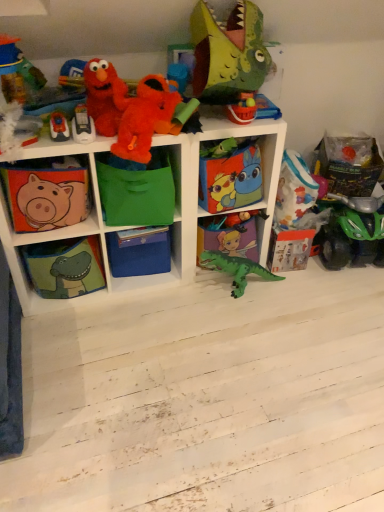
Find the location of `vacant space that's between green fabric storage cubes at center, which is counted as the 3th shelf, starting from the right, and green matte dinosaur at center, positioned as the fifth shelf in left-to-right order`. vacant space that's between green fabric storage cubes at center, which is counted as the 3th shelf, starting from the right, and green matte dinosaur at center, positioned as the fifth shelf in left-to-right order is located at coordinates (156, 291).